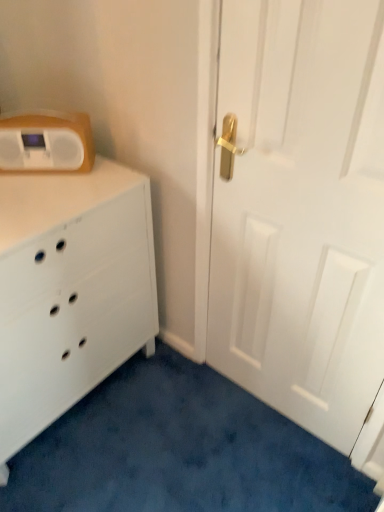
Question: From a real-world perspective, is matte white radio at upper left on white matte door at right?

Choices:
 (A) yes
 (B) no

Answer: (A)

Question: Is matte white radio at upper left oriented away from white matte door at right?

Choices:
 (A) no
 (B) yes

Answer: (A)

Question: Is matte white radio at upper left to the right of white matte door at right from the viewer's perspective?

Choices:
 (A) no
 (B) yes

Answer: (A)

Question: Can white matte door at right be found inside matte white radio at upper left?

Choices:
 (A) no
 (B) yes

Answer: (A)

Question: Is matte white radio at upper left closer to camera compared to white matte door at right?

Choices:
 (A) yes
 (B) no

Answer: (B)

Question: Is matte white radio at upper left bigger or smaller than white matte chest of drawers at left?

Choices:
 (A) big
 (B) small

Answer: (B)

Question: Looking at their shapes, would you say matte white radio at upper left is wider or thinner than white matte chest of drawers at left?

Choices:
 (A) wide
 (B) thin

Answer: (B)

Question: From a real-world perspective, is matte white radio at upper left physically located above or below white matte chest of drawers at left?

Choices:
 (A) above
 (B) below

Answer: (A)

Question: Considering the positions of point (21, 161) and point (97, 329), is point (21, 161) closer or farther from the camera than point (97, 329)?

Choices:
 (A) farther
 (B) closer

Answer: (B)

Question: Considering the positions of white matte door at right and matte white radio at upper left in the image, is white matte door at right bigger or smaller than matte white radio at upper left?

Choices:
 (A) big
 (B) small

Answer: (A)

Question: In the image, is white matte door at right positioned in front of or behind matte white radio at upper left?

Choices:
 (A) front
 (B) behind

Answer: (A)

Question: Visually, is white matte door at right positioned to the left or to the right of matte white radio at upper left?

Choices:
 (A) right
 (B) left

Answer: (A)

Question: From a real-world perspective, is white matte door at right physically located above or below matte white radio at upper left?

Choices:
 (A) above
 (B) below

Answer: (B)

Question: From a real-world perspective, is white matte chest of drawers at left above or below matte white radio at upper left?

Choices:
 (A) below
 (B) above

Answer: (A)

Question: Is white matte chest of drawers at left to the left or to the right of matte white radio at upper left in the image?

Choices:
 (A) left
 (B) right

Answer: (A)